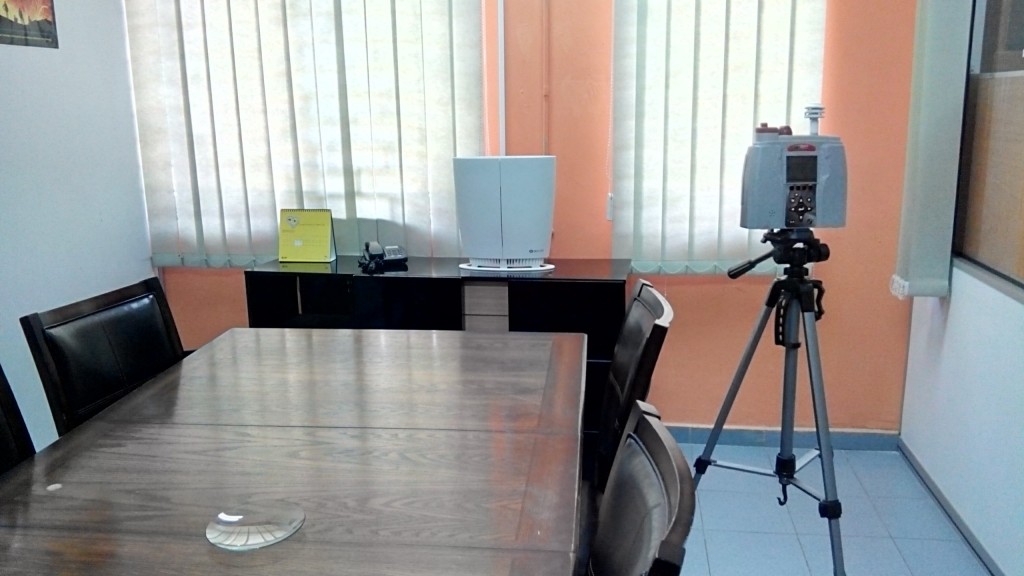
Locate an element on the screen. glass object on conference table is located at coordinates click(250, 530).